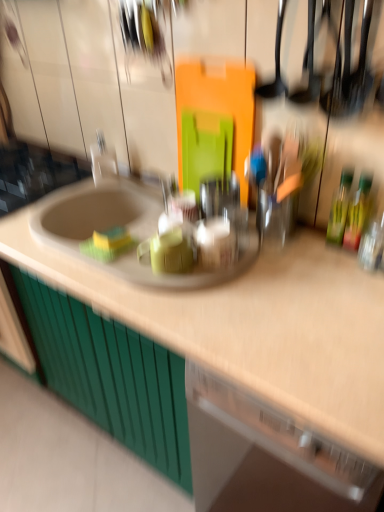
The image size is (384, 512). In order to click on free space to the left of green glass bottle at right, which ranks as the 2th bottle in right-to-left order in this screenshot , I will do `click(288, 258)`.